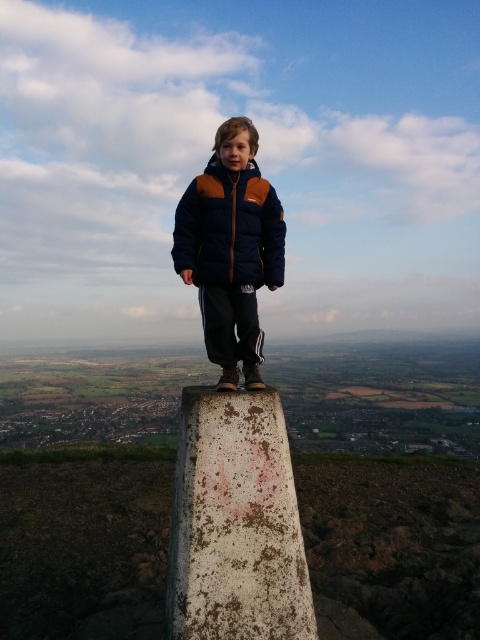
Does white weathered stone at center have a smaller size compared to navy blue down jacket at center?

Actually, white weathered stone at center might be larger than navy blue down jacket at center.

The width and height of the screenshot is (480, 640). What are the coordinates of `white weathered stone at center` in the screenshot? It's located at (236, 524).